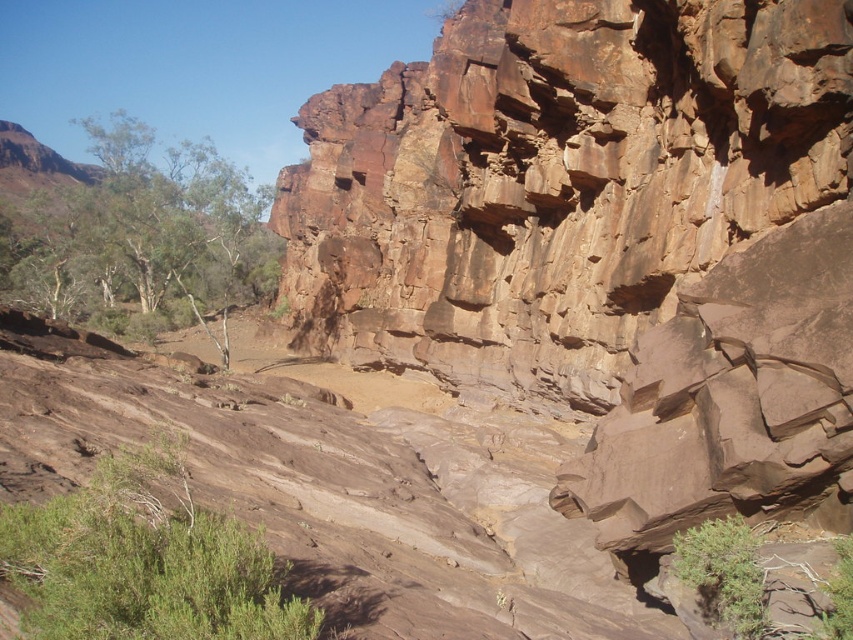
You are a hiker planning to set up camp in this area. You notice the green leafy tree at upper left and the green leafy shrub at lower left. Which of these two plants would likely provide more shade for your tent?

The green leafy tree at upper left would provide more shade for your tent since it has a larger size compared to the green leafy shrub at lower left.

You are a geologist studying the rock formations in the image. You need to locate the brown rough rock face at upper center. Where exactly is it positioned in terms of coordinates?

The brown rough rock face at upper center is located at coordinates point (x=555, y=180).